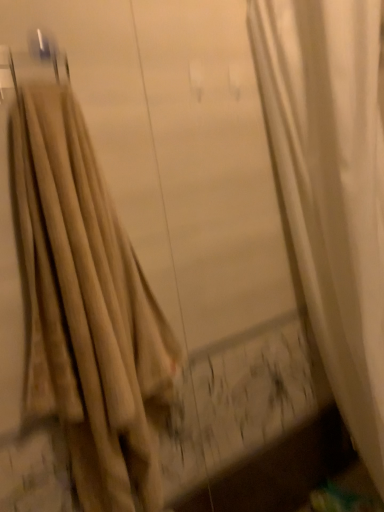
Question: Is beige fabric curtain at left wider or thinner than metallic silver hanger at upper left?

Choices:
 (A) thin
 (B) wide

Answer: (B)

Question: Relative to metallic silver hanger at upper left, is beige fabric curtain at left in front or behind?

Choices:
 (A) behind
 (B) front

Answer: (B)

Question: In terms of size, does beige fabric curtain at left appear bigger or smaller than metallic silver hanger at upper left?

Choices:
 (A) small
 (B) big

Answer: (B)

Question: Is metallic silver hanger at upper left wider or thinner than beige fabric curtain at left?

Choices:
 (A) wide
 (B) thin

Answer: (B)

Question: From their relative heights in the image, would you say metallic silver hanger at upper left is taller or shorter than beige fabric curtain at left?

Choices:
 (A) tall
 (B) short

Answer: (B)

Question: From the image's perspective, relative to beige fabric curtain at left, is metallic silver hanger at upper left above or below?

Choices:
 (A) below
 (B) above

Answer: (B)

Question: Is metallic silver hanger at upper left inside the boundaries of beige fabric curtain at left, or outside?

Choices:
 (A) inside
 (B) outside

Answer: (B)